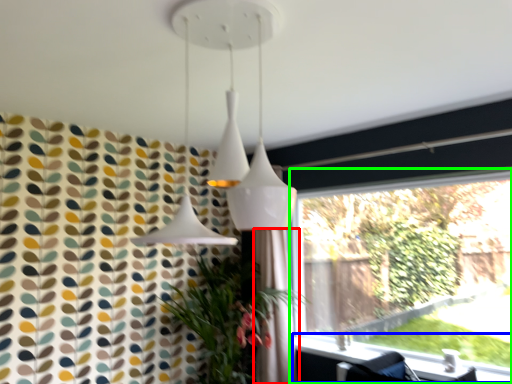
Question: Based on their relative distances, which object is farther from shower curtain (highlighted by a red box)? Choose from window sill (highlighted by a blue box) and window (highlighted by a green box).

Choices:
 (A) window sill
 (B) window

Answer: (B)